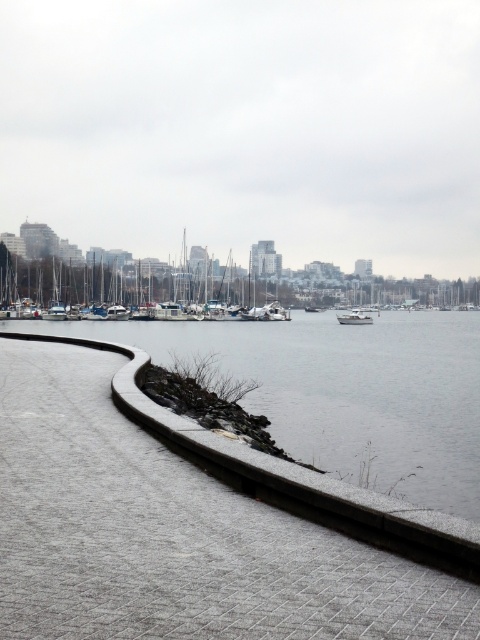
Can you confirm if gray concrete water at center is positioned above white matte boat at center?

Incorrect, gray concrete water at center is not positioned above white matte boat at center.

From the picture: Between gray concrete water at center and white matte boat at center, which one is positioned lower?

gray concrete water at center is lower down.

This screenshot has height=640, width=480. What do you see at coordinates (345, 392) in the screenshot?
I see `gray concrete water at center` at bounding box center [345, 392].

I want to click on gray concrete water at center, so click(x=345, y=392).

Is white matte sailboat at center positioned in front of white matte boat at center?

No.

Which is above, white matte sailboat at center or white matte boat at center?

white matte sailboat at center

Is point (99, 257) more distant than point (349, 321)?

Yes, it is.

At what (x,y) coordinates should I click in order to perform the action: click on white matte sailboat at center. Please return your answer as a coordinate pair (x, y). The height and width of the screenshot is (640, 480). Looking at the image, I should click on (127, 282).

Who is higher up, gray concrete water at center or white matte sailboat at center?

white matte sailboat at center is higher up.

Image resolution: width=480 pixels, height=640 pixels. Describe the element at coordinates (345, 392) in the screenshot. I see `gray concrete water at center` at that location.

What do you see at coordinates (345, 392) in the screenshot?
I see `gray concrete water at center` at bounding box center [345, 392].

Find the location of `gray concrete water at center`. gray concrete water at center is located at coordinates (345, 392).